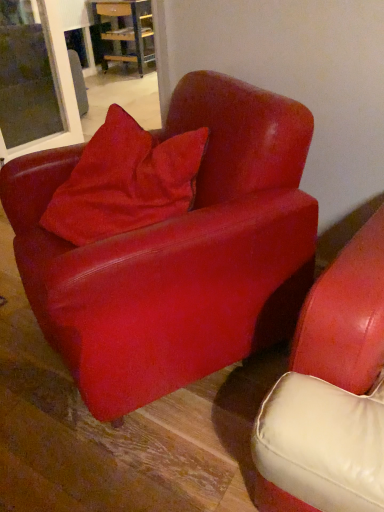
Question: Does matte red armchair at center have a larger size compared to wooden table at center?

Choices:
 (A) yes
 (B) no

Answer: (A)

Question: Is matte red armchair at center to the right of wooden table at center from the viewer's perspective?

Choices:
 (A) yes
 (B) no

Answer: (A)

Question: Is matte red armchair at center oriented away from wooden table at center?

Choices:
 (A) no
 (B) yes

Answer: (A)

Question: Does matte red armchair at center have a lesser width compared to wooden table at center?

Choices:
 (A) no
 (B) yes

Answer: (A)

Question: From the image's perspective, does matte red armchair at center appear lower than wooden table at center?

Choices:
 (A) no
 (B) yes

Answer: (B)

Question: From a real-world perspective, is wooden table at center positioned above or below matte red armchair at center?

Choices:
 (A) below
 (B) above

Answer: (A)

Question: Is wooden table at center wider or thinner than matte red armchair at center?

Choices:
 (A) wide
 (B) thin

Answer: (B)

Question: Is wooden table at center taller or shorter than matte red armchair at center?

Choices:
 (A) tall
 (B) short

Answer: (B)

Question: Would you say wooden table at center is to the left or to the right of matte red armchair at center in the picture?

Choices:
 (A) left
 (B) right

Answer: (A)

Question: Is matte red armchair at center taller or shorter than wooden table at center?

Choices:
 (A) short
 (B) tall

Answer: (B)

Question: Is matte red armchair at center situated inside wooden table at center or outside?

Choices:
 (A) inside
 (B) outside

Answer: (B)

Question: Based on their positions, is matte red armchair at center located to the left or right of wooden table at center?

Choices:
 (A) right
 (B) left

Answer: (A)

Question: From the image's perspective, is matte red armchair at center located above or below wooden table at center?

Choices:
 (A) below
 (B) above

Answer: (A)

Question: Visually, is velvet red pillow at center positioned to the left or to the right of wooden table at center?

Choices:
 (A) left
 (B) right

Answer: (B)

Question: Choose the correct answer: Is velvet red pillow at center inside wooden table at center or outside it?

Choices:
 (A) inside
 (B) outside

Answer: (B)